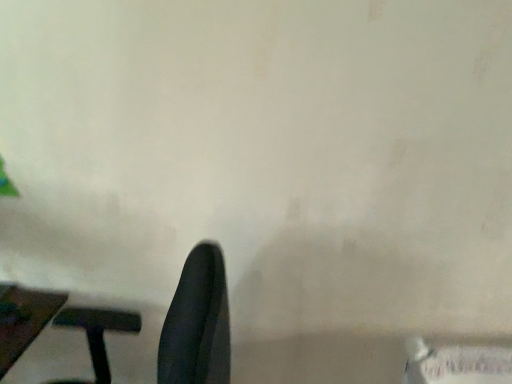
Image resolution: width=512 pixels, height=384 pixels. What are the coordinates of `black matte chair at left` in the screenshot? It's located at (197, 323).

In order to face black matte chair at left, should I rotate leftwards or rightwards?

It's best to rotate left around 20.090 degrees.

Image resolution: width=512 pixels, height=384 pixels. What do you see at coordinates (197, 323) in the screenshot?
I see `black matte chair at left` at bounding box center [197, 323].

This screenshot has height=384, width=512. What are the coordinates of `black matte chair at left` in the screenshot? It's located at (197, 323).